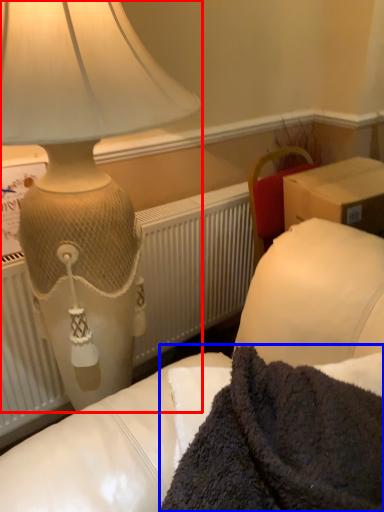
Question: Which of the following is the closest to the observer, lamp (highlighted by a red box) or blanket (highlighted by a blue box)?

Choices:
 (A) lamp
 (B) blanket

Answer: (B)